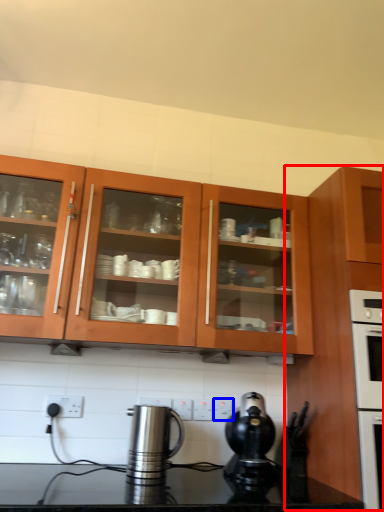
Question: Among these objects, which one is farthest to the camera, cabinetry (highlighted by a red box) or electric outlet (highlighted by a blue box)?

Choices:
 (A) cabinetry
 (B) electric outlet

Answer: (B)